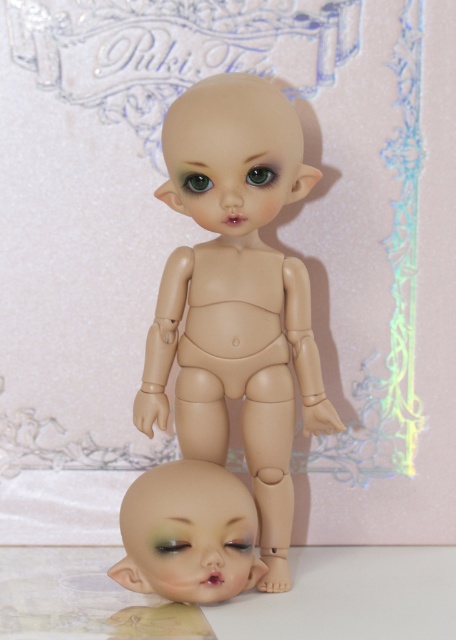
You are an interior designer working on a project where you need to place a small decorative item exactly at the center of the room. You have a matte beige doll at center. Can you confirm if placing it at point (237,296) would be at the true center of the room?

Yes, placing the matte beige doll at center at point (237,296) would be at the true center of the room as specified.

Consider the image. You are positioning a camera to capture the matte beige doll at center. Given its coordinates at point 0.464, 0.520, where should you aim the camera to ensure the doll is centered in the frame?

The matte beige doll at center is already positioned at coordinates (237, 296), which corresponds to the center of the frame. Therefore, aiming the camera directly at these coordinates will center the doll in the image.